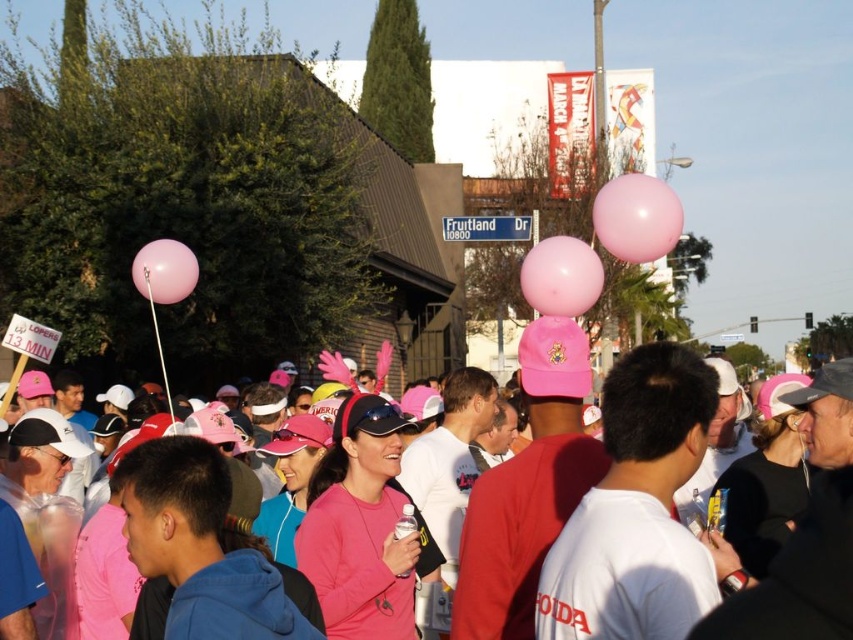
You are a participant in the event and want to know which balloon is higher in the sky between the pink matte balloon at center and the pink rubber balloon at center. Based on the scene description, which one is taller?

The pink matte balloon at center is much taller than the pink rubber balloon at center, so the pink matte balloon at center is the taller one in the sky.

Consider the image. You are a photographer at the event and want to capture a photo that includes both the pink matte balloon at center and the pink rubber balloon at upper right. Which balloon should you focus on first to ensure both are in the frame?

The pink matte balloon at center is positioned under the pink rubber balloon at upper right, so focusing on the pink matte balloon at center first will ensure both are in the frame as the upper one is above it.

You are a photographer standing at the starting line of a charity run. You want to capture a photo of the pink matte balloon at center from your current position. Is the balloon within a 25 meter range of your camera?

The pink matte balloon at center is 22.97 meters away from the camera, which is within the 25 meter range. Therefore, the balloon can be captured in the photo from your current position.